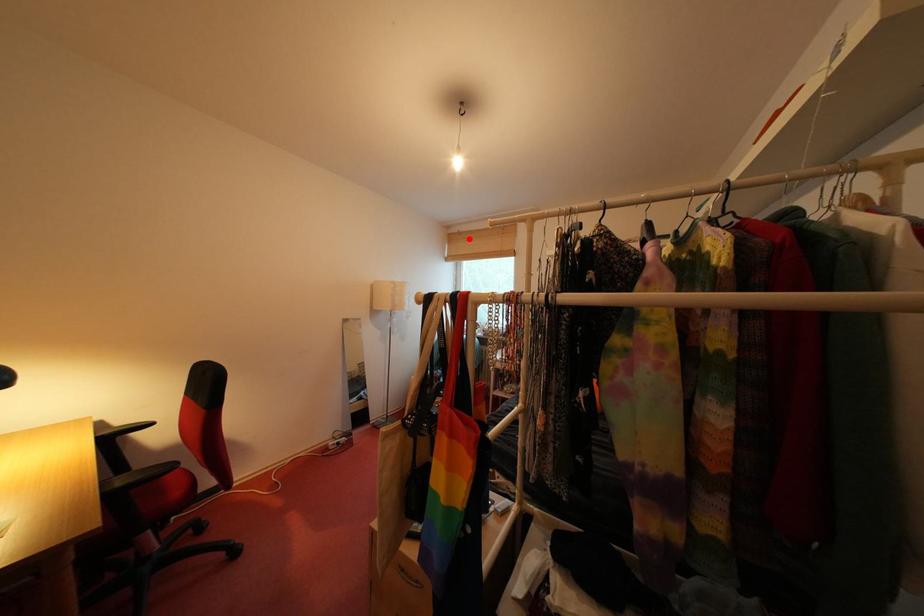
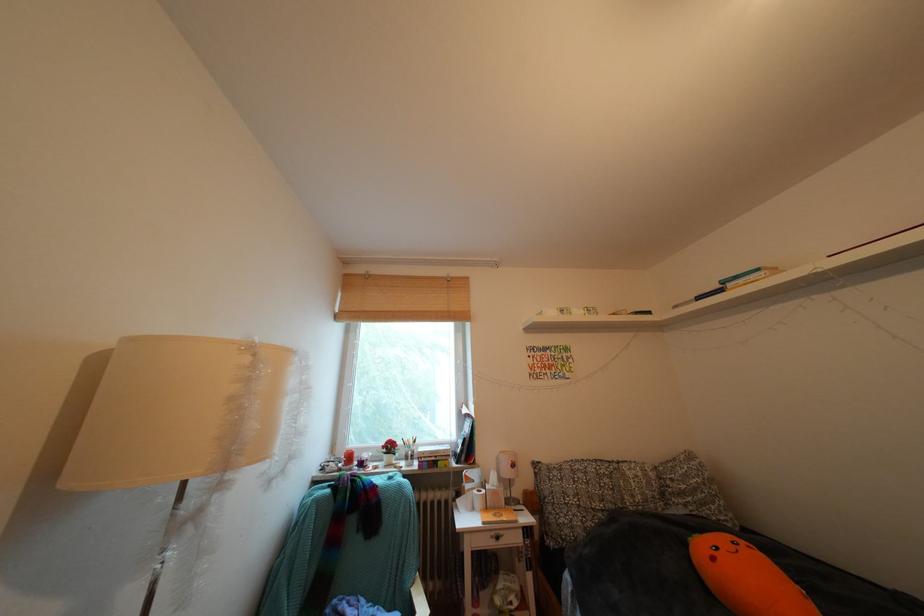
In the second image, find the point that corresponds to the highlighted location in the first image.

(379, 282)